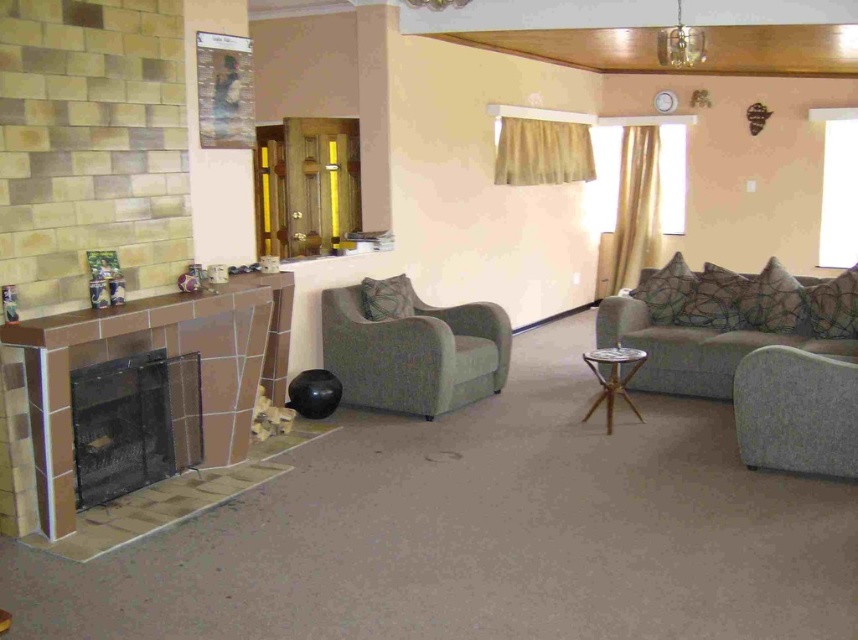
Question: Which object is the closest to the matte green fabric armchair at center?

Choices:
 (A) brown tile fireplace at left
 (B) black mesh fireplace at lower left
 (C) textured gray couch at right

Answer: (A)

Question: Can you confirm if black mesh fireplace at lower left is bigger than textured gray armchair at lower right?

Choices:
 (A) yes
 (B) no

Answer: (A)

Question: Does brown tile fireplace at left have a greater width compared to wooden tripod table at center?

Choices:
 (A) yes
 (B) no

Answer: (A)

Question: Which object appears farthest from the camera in this image?

Choices:
 (A) black mesh fireplace at lower left
 (B) textured gray armchair at lower right

Answer: (B)

Question: Which object is positioned closest to the black mesh fireplace at lower left?

Choices:
 (A) textured gray armchair at lower right
 (B) wooden tripod table at center
 (C) brown tile fireplace at left
 (D) matte green fabric armchair at center

Answer: (C)

Question: Can you confirm if textured gray couch at right is positioned above black mesh fireplace at lower left?

Choices:
 (A) no
 (B) yes

Answer: (B)